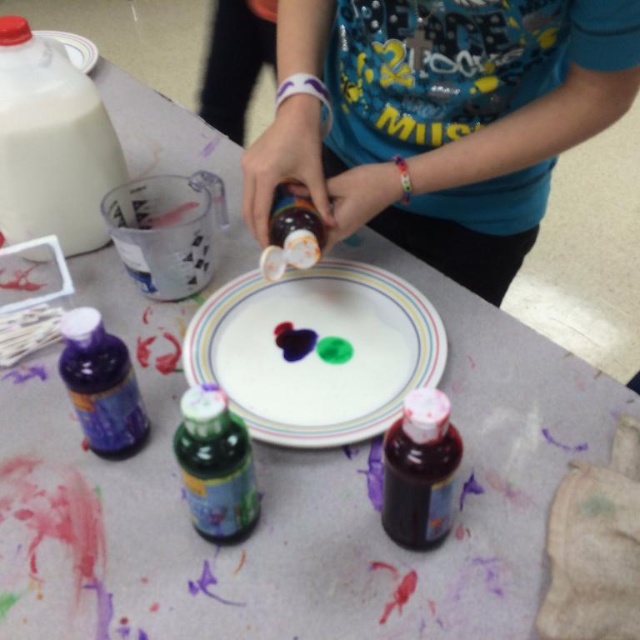
Question: From the image, what is the correct spatial relationship of matte white plate at center in relation to white glossy plate at center?

Choices:
 (A) right
 (B) left

Answer: (A)

Question: Which object appears farthest from the camera in this image?

Choices:
 (A) matte white plate at center
 (B) white matte plastic jug at upper left

Answer: (B)

Question: Does translucent green bottle at center appear under white glossy plate at center?

Choices:
 (A) yes
 (B) no

Answer: (A)

Question: Can you confirm if white matte plastic jug at upper left is bigger than translucent plastic bottle at center?

Choices:
 (A) no
 (B) yes

Answer: (B)

Question: Which object appears farthest from the camera in this image?

Choices:
 (A) white matte plastic jug at upper left
 (B) white glossy plate at center
 (C) translucent green bottle at center

Answer: (B)

Question: Which point is farther to the camera?

Choices:
 (A) white matte plastic jug at upper left
 (B) translucent purple bottle at lower left

Answer: (A)